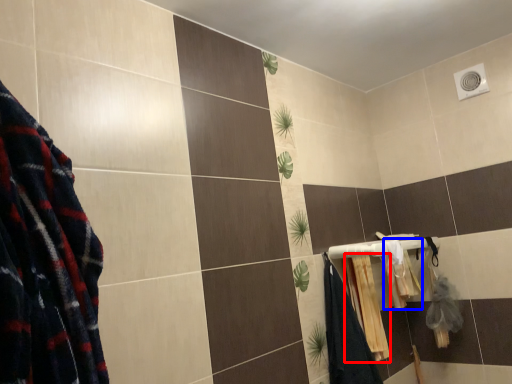
Question: Which of the following is the farthest to the observer, bath towel (highlighted by a red box) or bath towel (highlighted by a blue box)?

Choices:
 (A) bath towel
 (B) bath towel

Answer: (B)